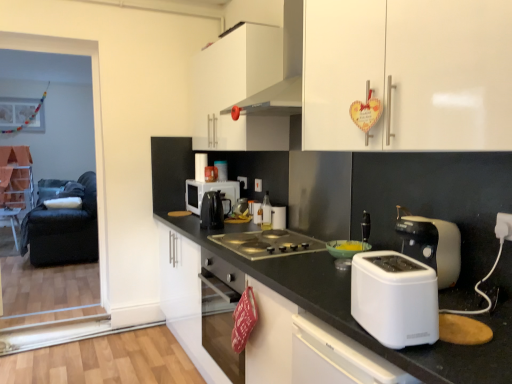
Question: Is white plastic electric outlet at right outside of translucent glass bottle at center, which is the 4th appliance in back-to-front order?

Choices:
 (A) no
 (B) yes

Answer: (B)

Question: From a real-world perspective, is white plastic electric outlet at right beneath translucent glass bottle at center, which is the 4th appliance in back-to-front order?

Choices:
 (A) no
 (B) yes

Answer: (A)

Question: Is white plastic electric outlet at right in contact with translucent glass bottle at center, which is the 4th appliance in back-to-front order?

Choices:
 (A) yes
 (B) no

Answer: (B)

Question: Is white plastic electric outlet at right smaller than translucent glass bottle at center, arranged as the 2th appliance when viewed from the front?

Choices:
 (A) yes
 (B) no

Answer: (A)

Question: Considering the relative positions of white plastic electric outlet at right and translucent glass bottle at center, which appears as the third appliance when viewed from the left, in the image provided, is white plastic electric outlet at right to the right of translucent glass bottle at center, which appears as the third appliance when viewed from the left, from the viewer's perspective?

Choices:
 (A) yes
 (B) no

Answer: (A)

Question: Is white plastic electric outlet at right taller or shorter than black fabric screen door at left?

Choices:
 (A) tall
 (B) short

Answer: (B)

Question: From the image's perspective, relative to black fabric screen door at left, is white plastic electric outlet at right above or below?

Choices:
 (A) below
 (B) above

Answer: (A)

Question: Would you say white plastic electric outlet at right is inside or outside black fabric screen door at left?

Choices:
 (A) inside
 (B) outside

Answer: (B)

Question: Considering the relative positions of white plastic electric outlet at right and black fabric screen door at left in the image provided, is white plastic electric outlet at right to the left or to the right of black fabric screen door at left?

Choices:
 (A) right
 (B) left

Answer: (A)

Question: In terms of height, does white glossy cabinet at upper center, which appears as the second cabinetry when viewed from the left, look taller or shorter compared to black fabric screen door at left?

Choices:
 (A) short
 (B) tall

Answer: (A)

Question: Is white glossy cabinet at upper center, which is the 1th cabinetry in right-to-left order, wider or thinner than black fabric screen door at left?

Choices:
 (A) thin
 (B) wide

Answer: (B)

Question: Do you think white glossy cabinet at upper center, which appears as the first cabinetry when viewed from the front, is within black fabric screen door at left, or outside of it?

Choices:
 (A) outside
 (B) inside

Answer: (A)

Question: From a real-world perspective, is white glossy cabinet at upper center, which appears as the first cabinetry when viewed from the front, positioned above or below black fabric screen door at left?

Choices:
 (A) above
 (B) below

Answer: (A)

Question: In the image, is metallic gray cooktop at center on the left side or the right side of white glossy countertop at center?

Choices:
 (A) right
 (B) left

Answer: (A)

Question: Is metallic gray cooktop at center bigger or smaller than white glossy countertop at center?

Choices:
 (A) small
 (B) big

Answer: (A)